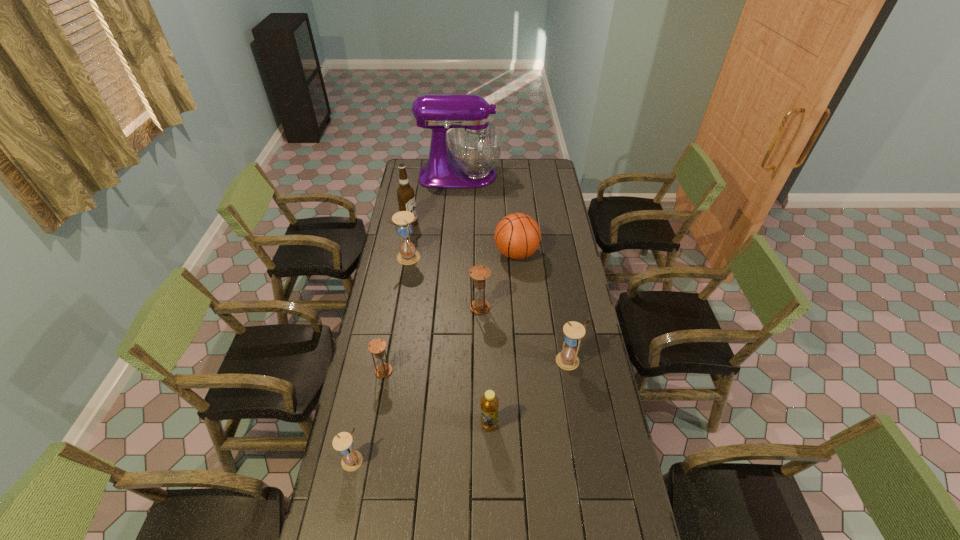
I want to click on free space that satisfies the following two spatial constraints: 1. at the bowl opening of the farthest object; 2. on the right side of the basketball, so click(x=456, y=254).